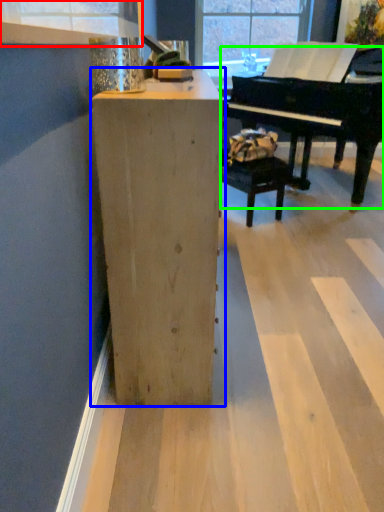
Question: Which object is the farthest from window frame (highlighted by a red box)? Choose among these: furniture (highlighted by a blue box) or piano (highlighted by a green box).

Choices:
 (A) furniture
 (B) piano

Answer: (B)